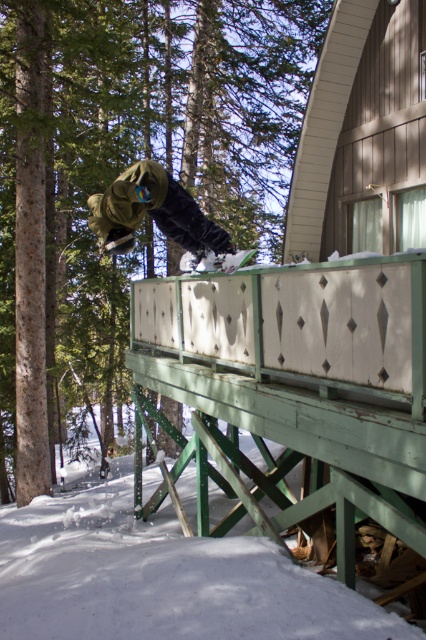
Question: Is white fluffy snow at lower left closer to the viewer compared to white matte snowboard at center?

Choices:
 (A) yes
 (B) no

Answer: (A)

Question: Among these points, which one is nearest to the camera?

Choices:
 (A) (184, 268)
 (B) (351, 609)
 (C) (189, 212)

Answer: (B)

Question: Which point is closer to the camera taking this photo?

Choices:
 (A) (137, 198)
 (B) (201, 259)
 (C) (11, 618)

Answer: (C)

Question: Is green matte snowboarder at center wider than white matte snowboard at center?

Choices:
 (A) yes
 (B) no

Answer: (A)

Question: Does white fluffy snow at lower left have a smaller size compared to green matte snowboarder at center?

Choices:
 (A) no
 (B) yes

Answer: (A)

Question: Which of the following is the closest to the observer?

Choices:
 (A) (186, 208)
 (B) (224, 269)

Answer: (B)